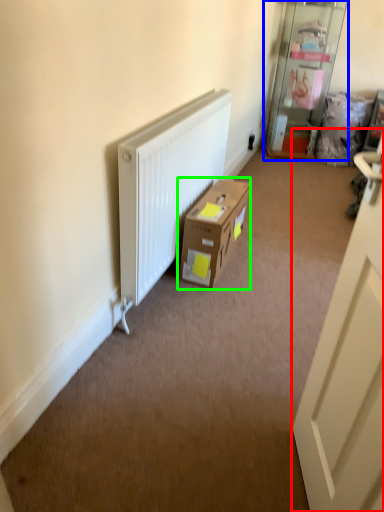
Question: Based on their relative distances, which object is nearer to door (highlighted by a red box)? Choose from shelf (highlighted by a blue box) and box (highlighted by a green box).

Choices:
 (A) shelf
 (B) box

Answer: (B)